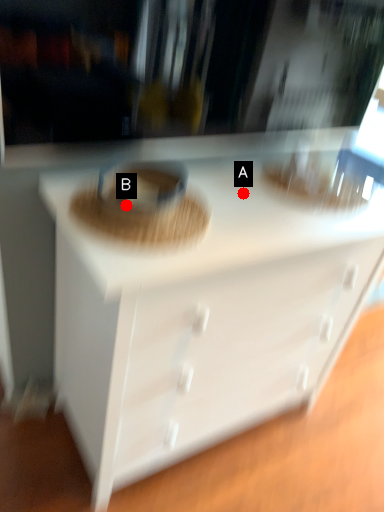
Question: Two points are circled on the image, labeled by A and B beside each circle. Which point is further to the camera?

Choices:
 (A) A is further
 (B) B is further

Answer: (A)